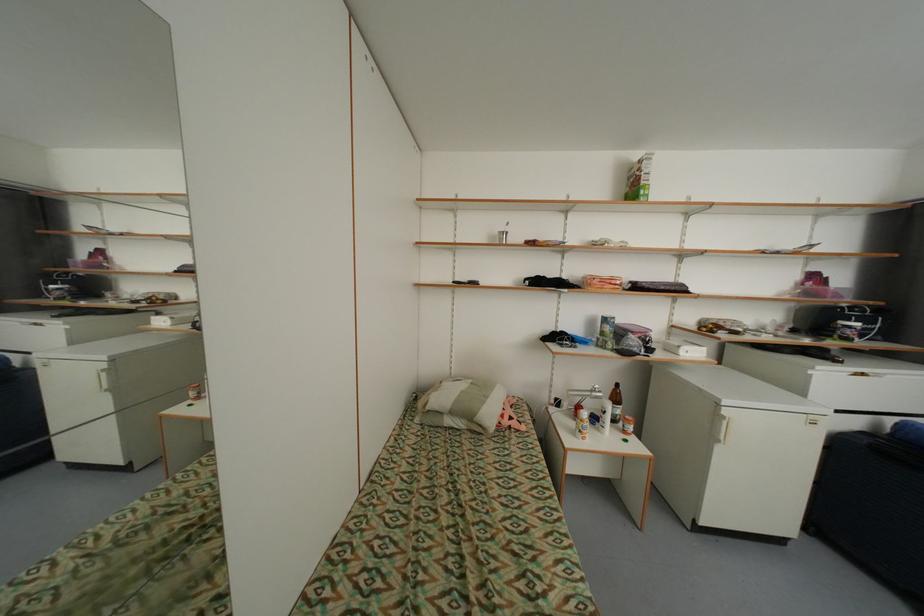
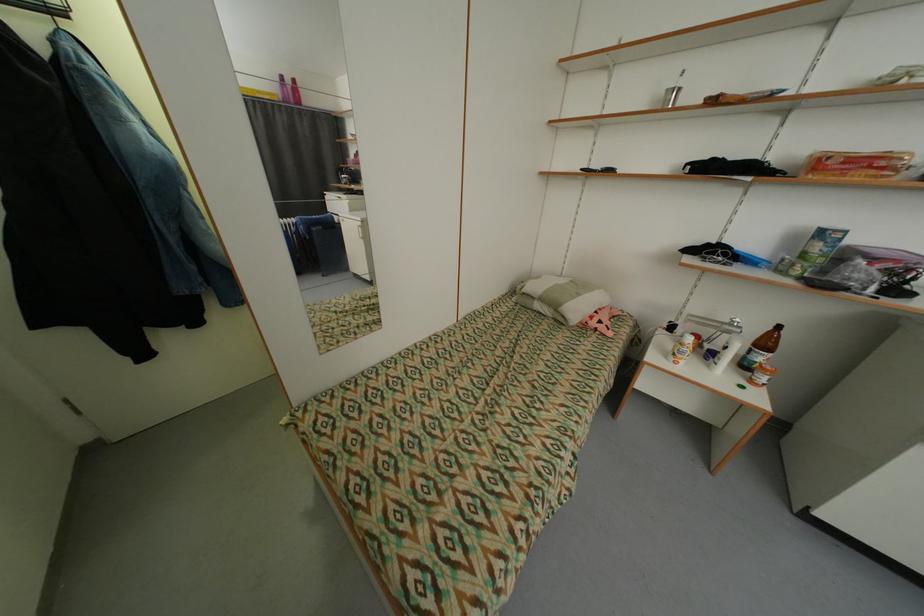
Where in the second image is the point corresponding to [493,398] from the first image?

(585, 296)